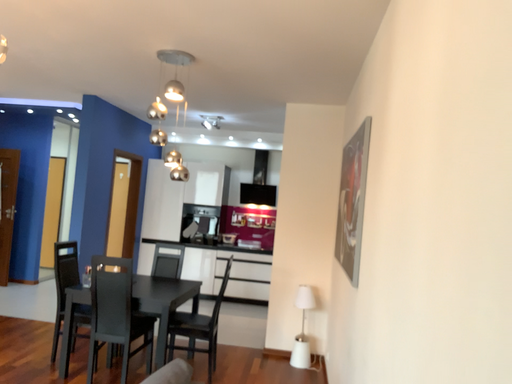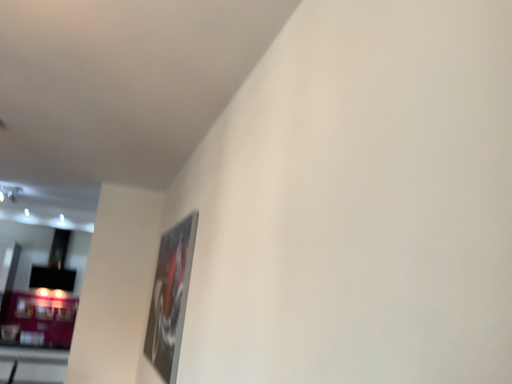
Question: Which way did the camera rotate in the video?

Choices:
 (A) rotated right
 (B) rotated left

Answer: (A)